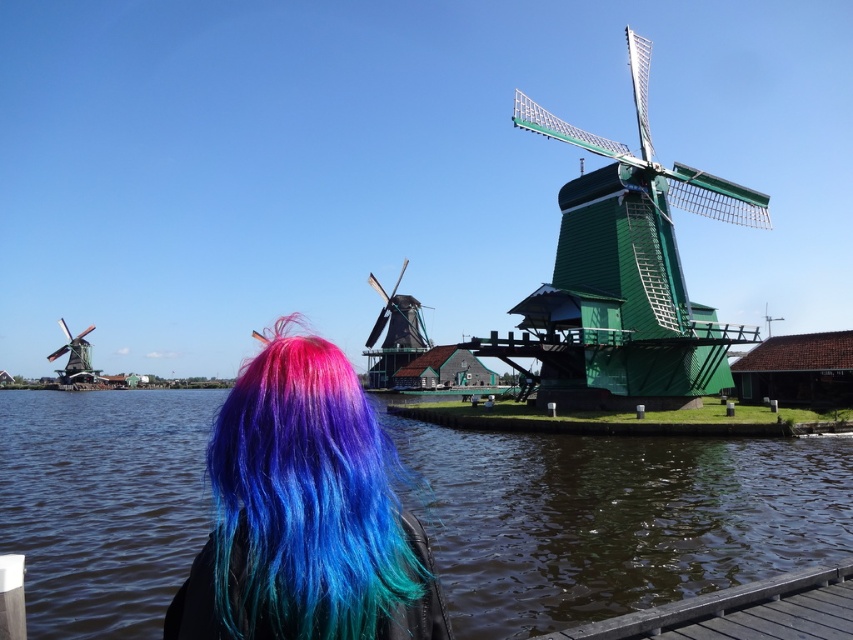
From the picture: You are standing at the edge of the waterway in the scene. If you want to reach the transparent water at lower center, which direction should you move relative to your current position?

The transparent water at lower center is located at point 0.811 on the x axis and 0.721 on the y axis. Since you are at the edge of the waterway, moving towards the center of the image would lead you to the transparent water at lower center.

In the scene shown: You are standing at the point marked by coordinates point (x=614, y=518). What is the terrain like at this location?

The terrain at point (x=614, y=518) is transparent water at lower center, as indicated by the coordinates provided.

You are standing at the viewpoint of the image and see two points marked in the scene. Which point is closer to you, point (392, 384) or point (73, 385)?

Point (392, 384) is in front of point (73, 385), so it is closer to you.